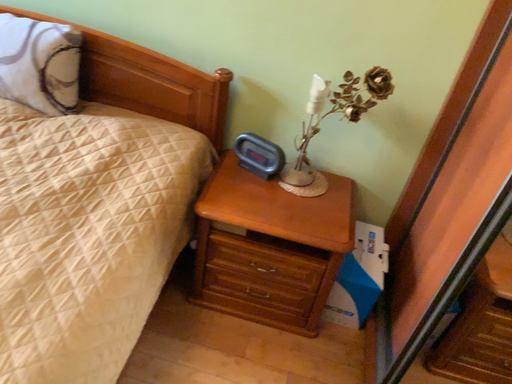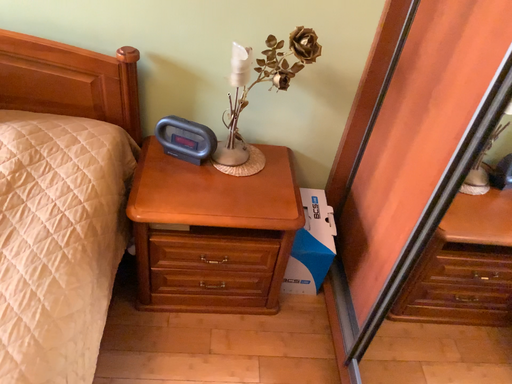
Question: Which way did the camera rotate in the video?

Choices:
 (A) rotated left
 (B) rotated right

Answer: (B)